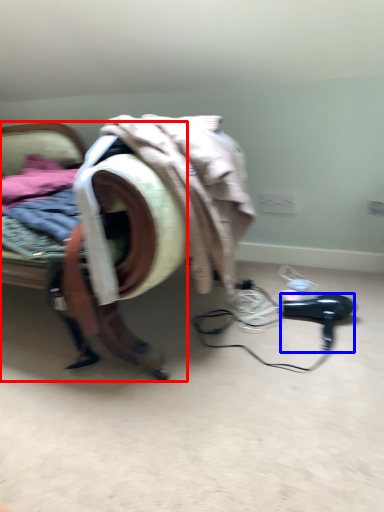
Question: Which point is further to the camera, furniture (highlighted by a red box) or hair drier (highlighted by a blue box)?

Choices:
 (A) furniture
 (B) hair drier

Answer: (B)